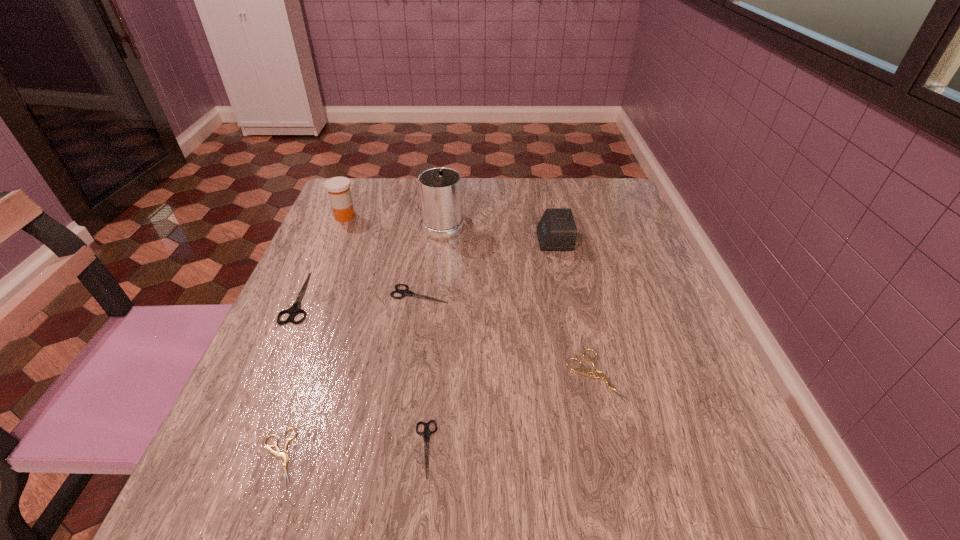
In order to click on mug in this screenshot , I will do `click(440, 188)`.

Find the location of a particular element. This screenshot has width=960, height=540. the tallest object is located at coordinates (440, 188).

I want to click on medicine, so click(338, 188).

What are the coordinates of `orange medicine` in the screenshot? It's located at (338, 188).

Locate an element on the screen. The width and height of the screenshot is (960, 540). black alarm clock is located at coordinates (556, 231).

Locate an element on the screen. The height and width of the screenshot is (540, 960). the sixth shortest object is located at coordinates (556, 231).

I want to click on the leftmost shears, so click(x=294, y=310).

The image size is (960, 540). Find the location of `the fifth shortest object`. the fifth shortest object is located at coordinates (294, 310).

Find the location of `the second smallest black shears`. the second smallest black shears is located at coordinates (406, 292).

The image size is (960, 540). I want to click on the fourth shortest object, so click(x=406, y=292).